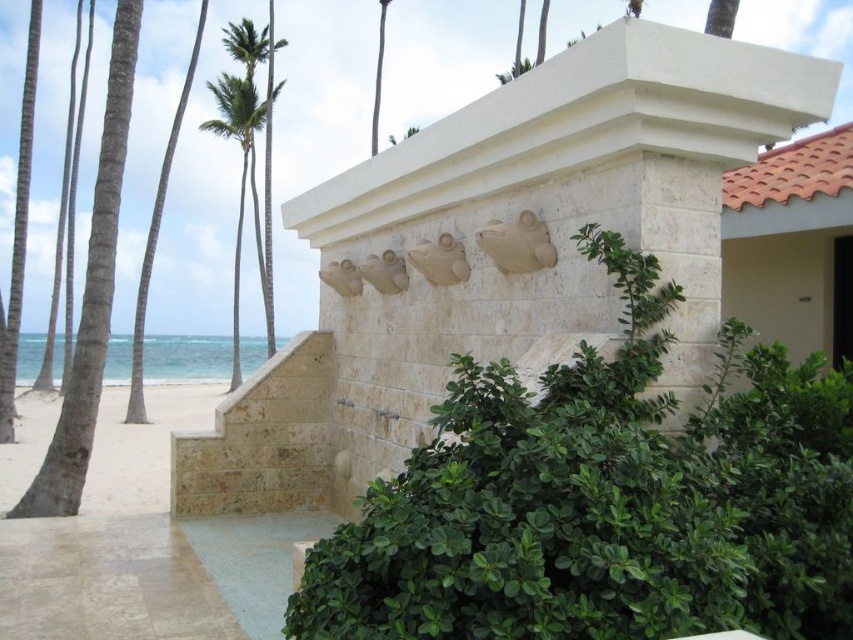
Question: Considering the relative positions of white stone sculpture at center and natural stone stairs at center in the image provided, where is white stone sculpture at center located with respect to natural stone stairs at center?

Choices:
 (A) right
 (B) left

Answer: (A)

Question: Which point is closer to the camera?

Choices:
 (A) beige stone steps at lower left
 (B) white sand at lower left
 (C) natural stone stairs at center
 (D) green leafy palm tree at upper left

Answer: (A)

Question: Which point is closer to the camera?

Choices:
 (A) natural stone stairs at center
 (B) white stone sculpture at center

Answer: (A)

Question: Is natural stone stairs at center positioned at the back of white sand at lower left?

Choices:
 (A) no
 (B) yes

Answer: (A)

Question: Which object is positioned closest to the white sand at lower left?

Choices:
 (A) natural stone stairs at center
 (B) beige stone steps at lower left
 (C) green leafy palm tree at upper left

Answer: (B)

Question: Considering the relative positions of white stone sculpture at center and beige stone steps at lower left in the image provided, where is white stone sculpture at center located with respect to beige stone steps at lower left?

Choices:
 (A) right
 (B) left

Answer: (A)